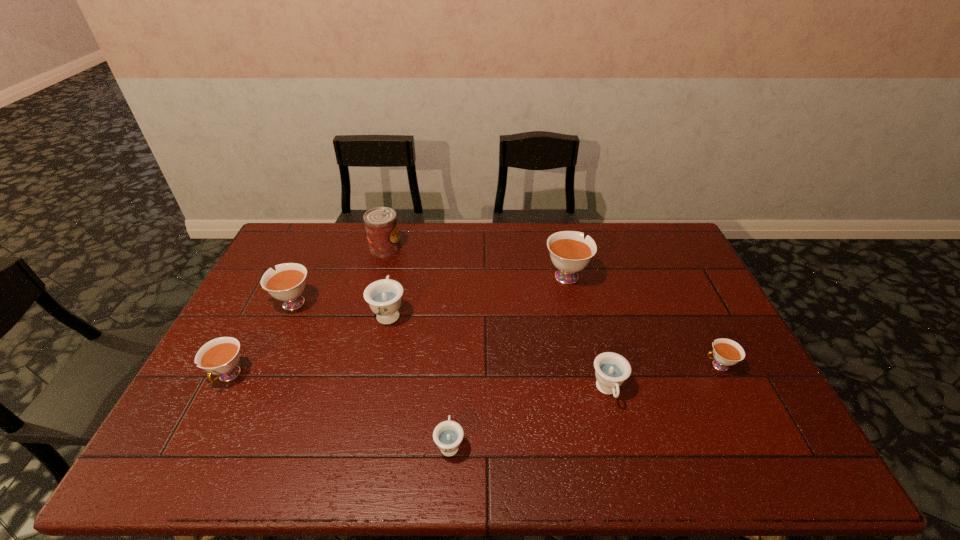
Locate which white teacup ranks second in proximity to the tallest teacup. Please provide its 2D coordinates. Your answer should be formatted as a tuple, i.e. [(x, y)], where the tuple contains the x and y coordinates of a point satisfying the conditions above.

[(287, 283)]

Where is `the closest white teacup to the rightmost object`? This screenshot has height=540, width=960. the closest white teacup to the rightmost object is located at coordinates (570, 253).

Locate which blue teacup ranks third in proximity to the can. Please provide its 2D coordinates. Your answer should be formatted as a tuple, i.e. [(x, y)], where the tuple contains the x and y coordinates of a point satisfying the conditions above.

[(611, 369)]

Identify which blue teacup is the second nearest to the second white teacup from right to left. Please provide its 2D coordinates. Your answer should be formatted as a tuple, i.e. [(x, y)], where the tuple contains the x and y coordinates of a point satisfying the conditions above.

[(384, 296)]

Image resolution: width=960 pixels, height=540 pixels. I want to click on free spot that satisfies the following two spatial constraints: 1. on the side of the rightmost object with the handle; 2. on the side of the second smallest white teacup with the handle, so click(724, 376).

I want to click on vacant region that satisfies the following two spatial constraints: 1. on the side of the third teacup from left to right with the handle; 2. on the side of the second biggest white teacup with the handle, so click(391, 303).

Identify the location of vacant space that satisfies the following two spatial constraints: 1. on the side of the second biggest white teacup with the handle; 2. on the side of the nearest object with the handle. The width and height of the screenshot is (960, 540). (x=227, y=444).

Where is `free location that satisfies the following two spatial constraints: 1. on the side of the second biggest white teacup with the handle; 2. on the side of the second smallest white teacup with the handle`? The width and height of the screenshot is (960, 540). free location that satisfies the following two spatial constraints: 1. on the side of the second biggest white teacup with the handle; 2. on the side of the second smallest white teacup with the handle is located at coordinates (257, 376).